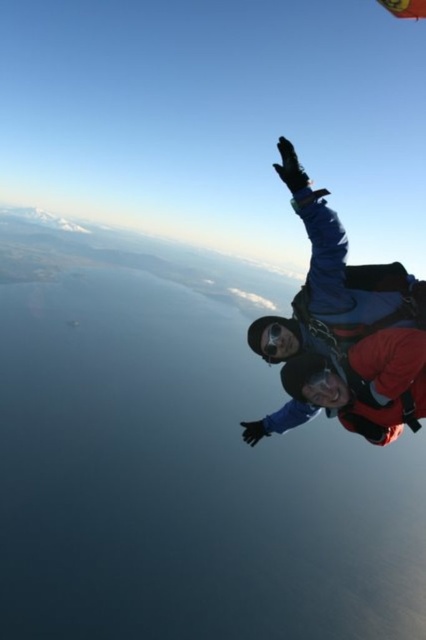
Question: Which of the following is the farthest from the observer?

Choices:
 (A) (403, 3)
 (B) (285, 422)

Answer: (A)

Question: Among these objects, which one is nearest to the camera?

Choices:
 (A) red nylon parachute at upper right
 (B) blue fabric parachute at right

Answer: (B)

Question: Can you confirm if blue fabric parachute at right is bigger than red nylon parachute at upper right?

Choices:
 (A) yes
 (B) no

Answer: (B)

Question: Can you confirm if blue fabric parachute at right is wider than red nylon parachute at upper right?

Choices:
 (A) no
 (B) yes

Answer: (A)

Question: Can you confirm if blue fabric parachute at right is positioned to the right of red nylon parachute at upper right?

Choices:
 (A) no
 (B) yes

Answer: (A)